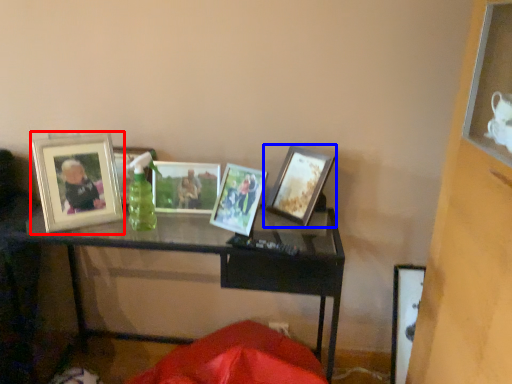
Question: Which object is closer to the camera taking this photo, picture frame (highlighted by a red box) or picture frame (highlighted by a blue box)?

Choices:
 (A) picture frame
 (B) picture frame

Answer: (A)